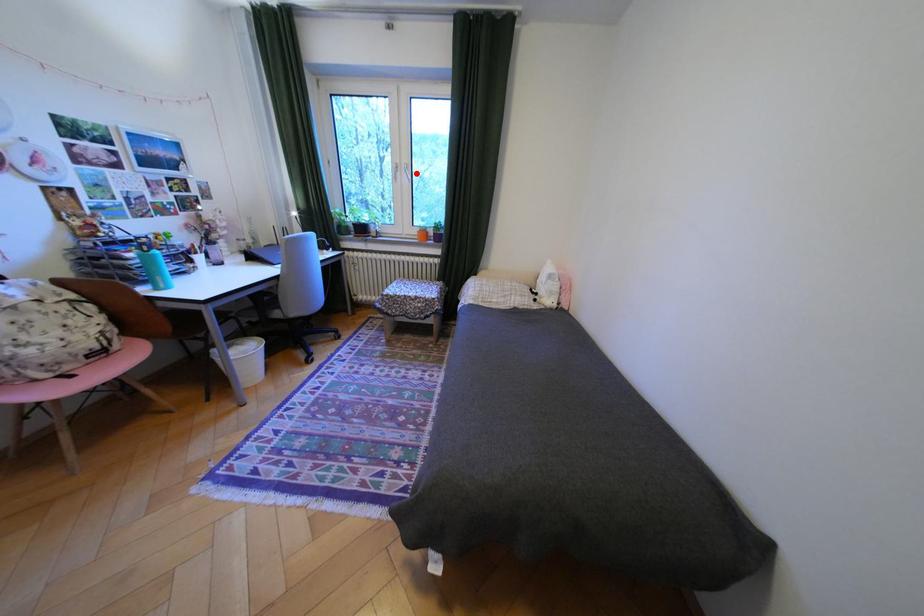
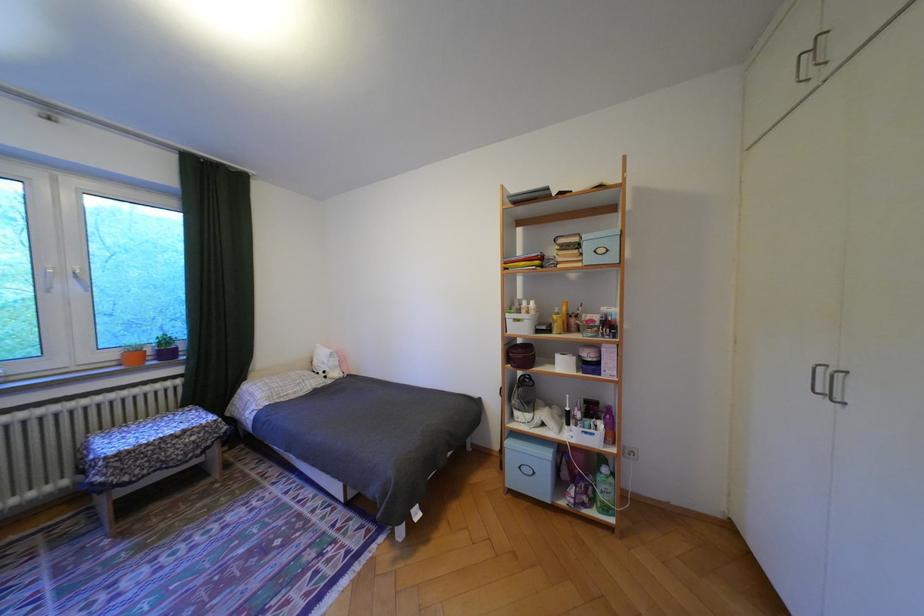
Where in the second image is the point corresponding to the highlighted location from the first image?

(84, 280)